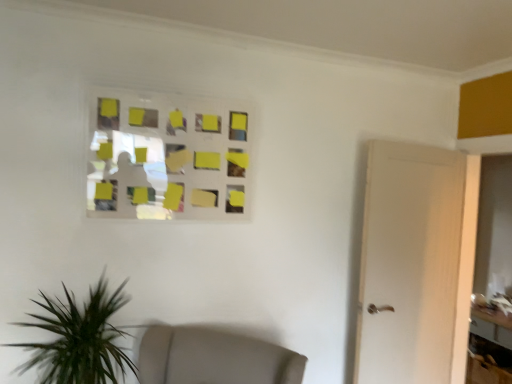
Question: Does wooden table at lower right have a smaller size compared to yellow matte glass window at upper center?

Choices:
 (A) yes
 (B) no

Answer: (B)

Question: Considering the relative sizes of wooden table at lower right and yellow matte glass window at upper center in the image provided, is wooden table at lower right wider than yellow matte glass window at upper center?

Choices:
 (A) no
 (B) yes

Answer: (B)

Question: Is the surface of wooden table at lower right in direct contact with yellow matte glass window at upper center?

Choices:
 (A) no
 (B) yes

Answer: (A)

Question: Considering the relative sizes of wooden table at lower right and yellow matte glass window at upper center in the image provided, is wooden table at lower right bigger than yellow matte glass window at upper center?

Choices:
 (A) no
 (B) yes

Answer: (B)

Question: Is yellow matte glass window at upper center located within wooden table at lower right?

Choices:
 (A) yes
 (B) no

Answer: (B)

Question: From the image's perspective, is wooden table at lower right on yellow matte glass window at upper center?

Choices:
 (A) no
 (B) yes

Answer: (A)

Question: Is there a large distance between yellow matte glass window at upper center and wooden table at lower right?

Choices:
 (A) no
 (B) yes

Answer: (B)

Question: Does yellow matte glass window at upper center have a lesser width compared to wooden table at lower right?

Choices:
 (A) no
 (B) yes

Answer: (B)

Question: Considering the relative positions of yellow matte glass window at upper center and wooden table at lower right in the image provided, is yellow matte glass window at upper center to the left of wooden table at lower right from the viewer's perspective?

Choices:
 (A) no
 (B) yes

Answer: (B)

Question: Is the surface of yellow matte glass window at upper center in direct contact with wooden table at lower right?

Choices:
 (A) yes
 (B) no

Answer: (B)

Question: Is yellow matte glass window at upper center turned away from wooden table at lower right?

Choices:
 (A) no
 (B) yes

Answer: (A)

Question: Is yellow matte glass window at upper center wider than wooden table at lower right?

Choices:
 (A) yes
 (B) no

Answer: (B)

Question: Is point (506, 337) positioned closer to the camera than point (167, 100)?

Choices:
 (A) farther
 (B) closer

Answer: (A)